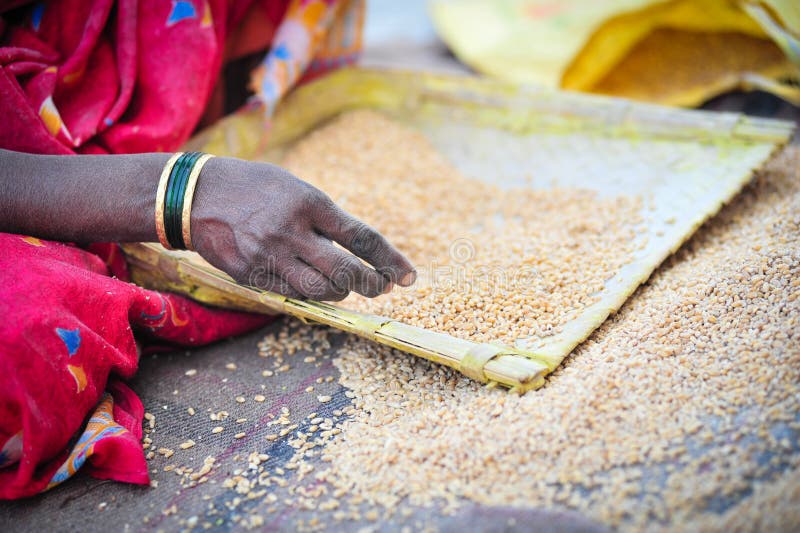
Find the location of `blue stripe in plaid fabric`. blue stripe in plaid fabric is located at coordinates (281, 445).